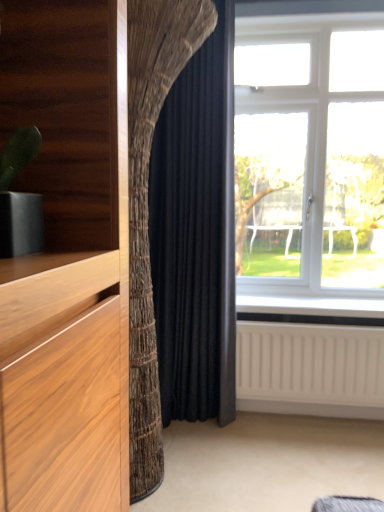
Where is `free point below white plastic window at right (from a real-world perspective)`? free point below white plastic window at right (from a real-world perspective) is located at coordinates (319, 302).